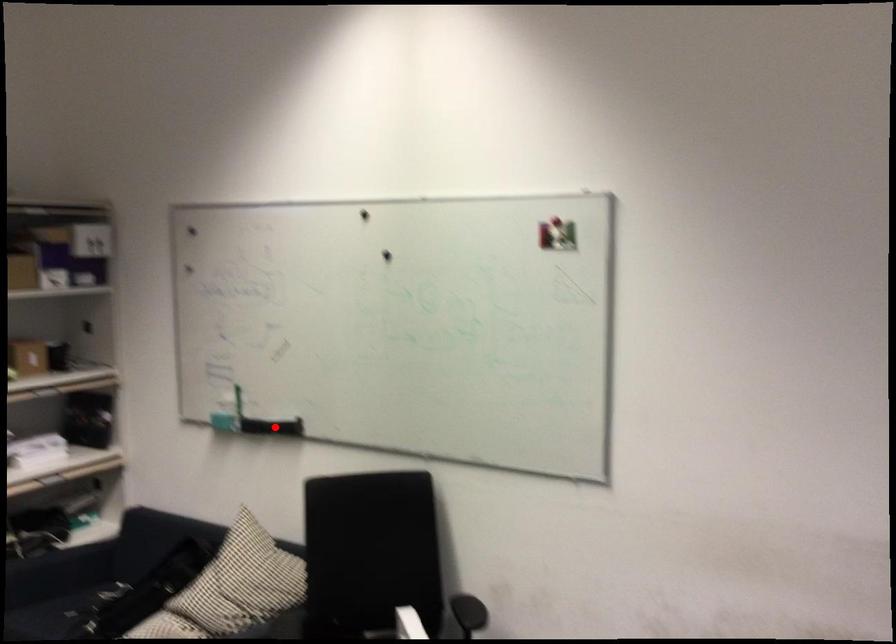
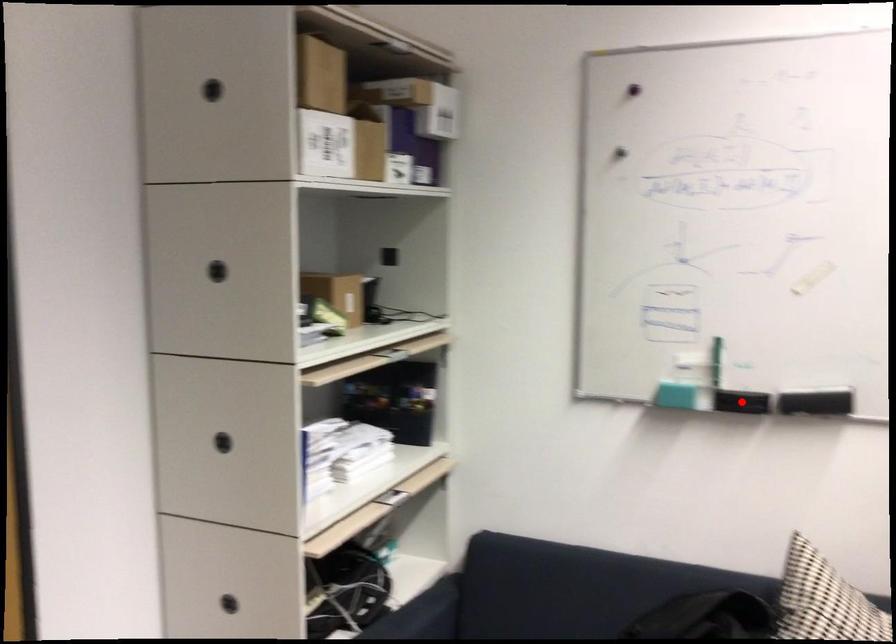
I am providing you with two images of the same scene from different viewpoints. A red point is marked on the first image and another point is marked on the second image. Does the point marked in image1 correspond to the same location as the one in image2?

No